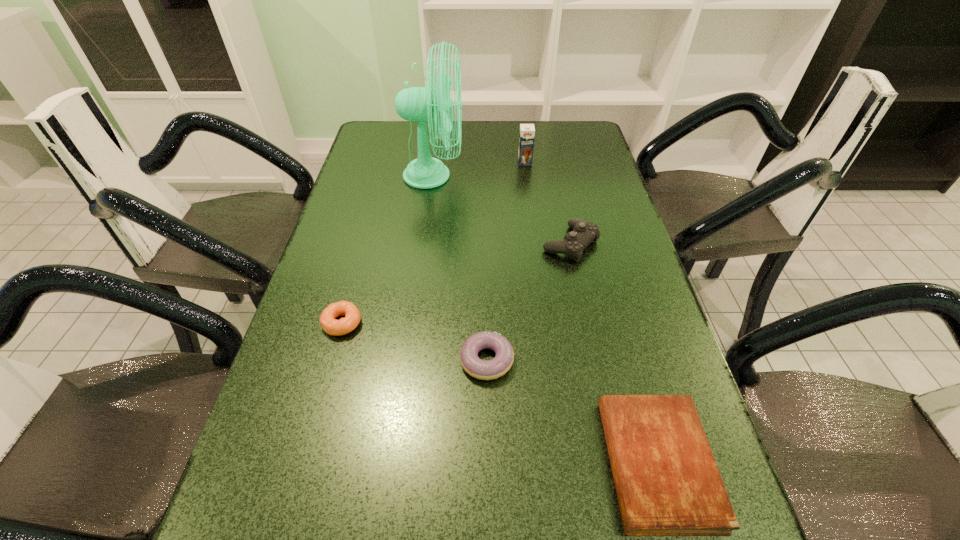
The width and height of the screenshot is (960, 540). In order to click on vacant area located 0.370m on the left of the fourth nearest object in this screenshot , I will do `click(399, 244)`.

Locate an element on the screen. This screenshot has width=960, height=540. vacant space situated on the left of the right doughnut is located at coordinates (430, 360).

This screenshot has width=960, height=540. Find the location of `vacant space located 0.080m on the spine side of the Bible`. vacant space located 0.080m on the spine side of the Bible is located at coordinates (562, 464).

Where is `vacant area situated 0.270m on the spine side of the Bible`? vacant area situated 0.270m on the spine side of the Bible is located at coordinates (451, 464).

Locate an element on the screen. This screenshot has width=960, height=540. vacant point located on the spine side of the Bible is located at coordinates (451, 464).

Image resolution: width=960 pixels, height=540 pixels. I want to click on free space located 0.280m on the right of the left doughnut, so click(x=490, y=323).

Find the location of a particular element. Image resolution: width=960 pixels, height=540 pixels. object present at the far edge is located at coordinates [417, 104].

In order to click on fan positioned at the left edge in this screenshot , I will do point(417,104).

Where is `doughnut at the left edge`? doughnut at the left edge is located at coordinates (328, 323).

Locate an element on the screen. The image size is (960, 540). control situated at the right edge is located at coordinates (584, 232).